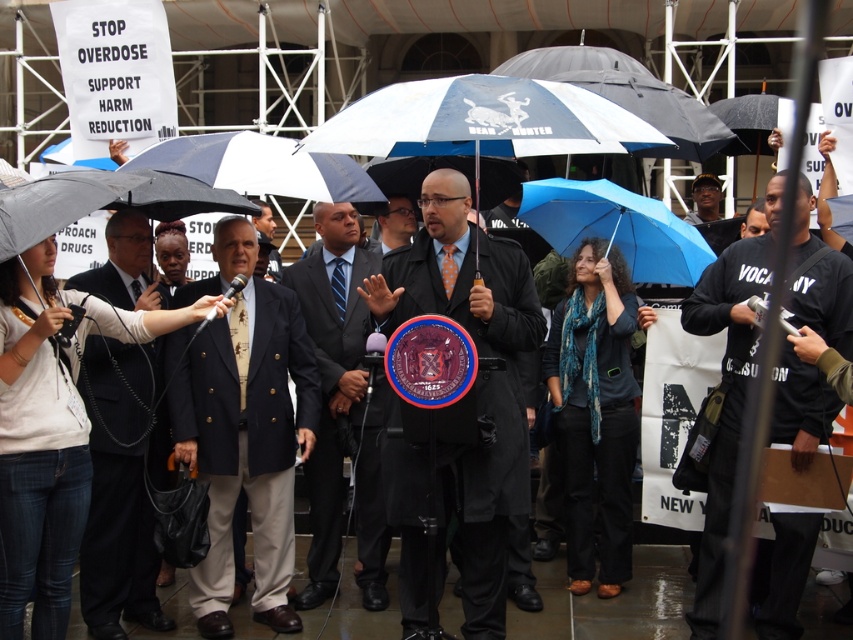
Question: Considering the relative positions of black cotton shirt at center and black suit at center in the image provided, where is black cotton shirt at center located with respect to black suit at center?

Choices:
 (A) above
 (B) below

Answer: (B)

Question: From the image, what is the correct spatial relationship of dark suit at left in relation to dark blue suit at center?

Choices:
 (A) right
 (B) left

Answer: (B)

Question: Is matte black coat at center bigger than blue matte umbrella at center?

Choices:
 (A) no
 (B) yes

Answer: (B)

Question: Which point is farther to the camera?

Choices:
 (A) dark blue suit at center
 (B) navy blue suit at center
 (C) dark suit at left
 (D) black suit at center

Answer: (A)

Question: Which of the following is the farthest from the observer?

Choices:
 (A) (384, 276)
 (B) (547, 214)

Answer: (B)

Question: Which object is farther from the camera taking this photo?

Choices:
 (A) dark suit at left
 (B) matte black coat at center

Answer: (A)